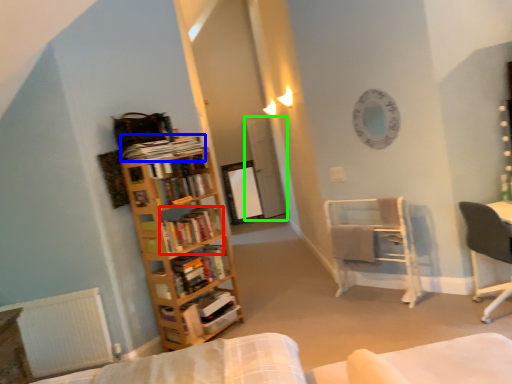
Question: Based on their relative distances, which object is nearer to book (highlighted by a red box)? Choose from book (highlighted by a blue box) and glass door (highlighted by a green box).

Choices:
 (A) book
 (B) glass door

Answer: (A)